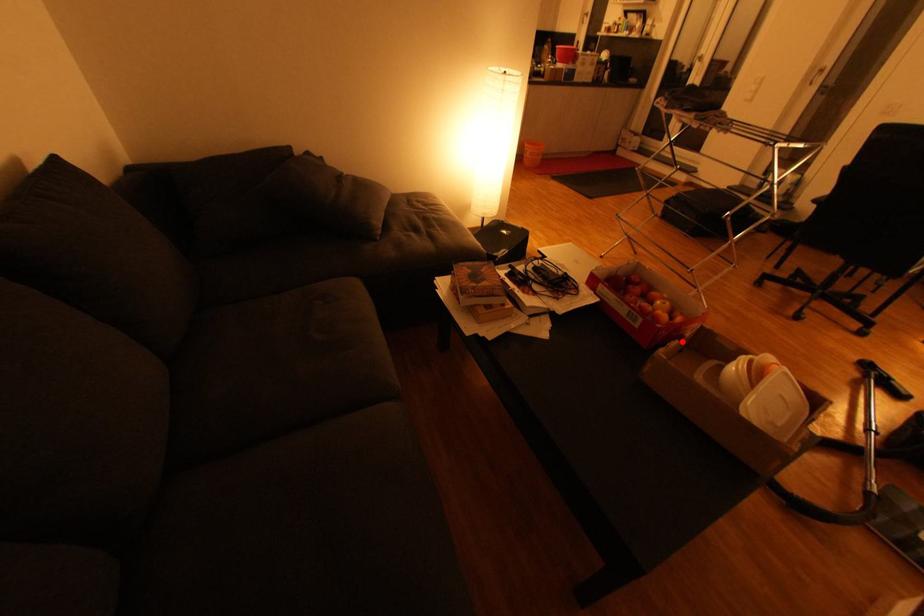
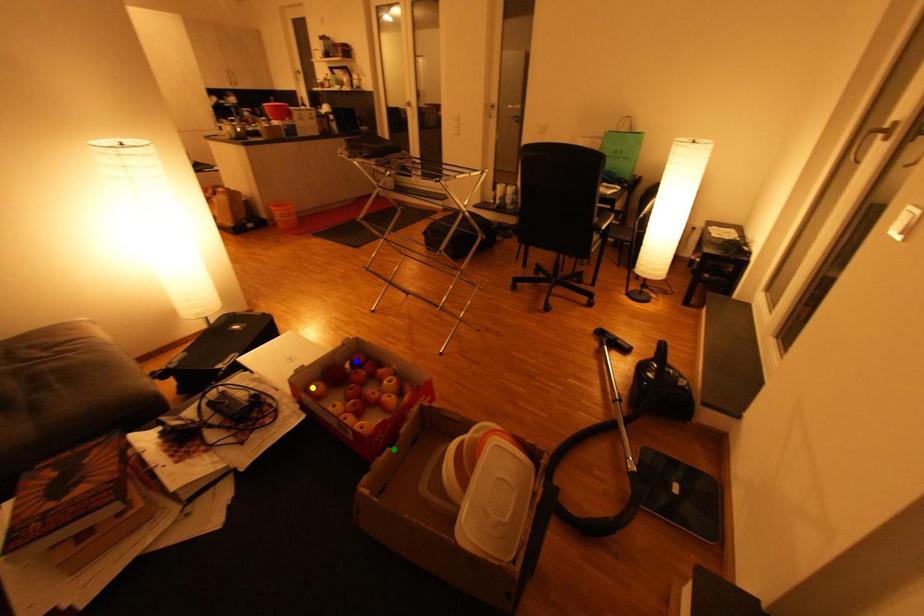
Question: I am providing you with two images of the same scene from different viewpoints. A red point is marked on the first image. You are given multiple points on the second image. Which point in image 2 represents the same 3d spot as the red point in image 1?

Choices:
 (A) blue point
 (B) yellow point
 (C) green point

Answer: (C)